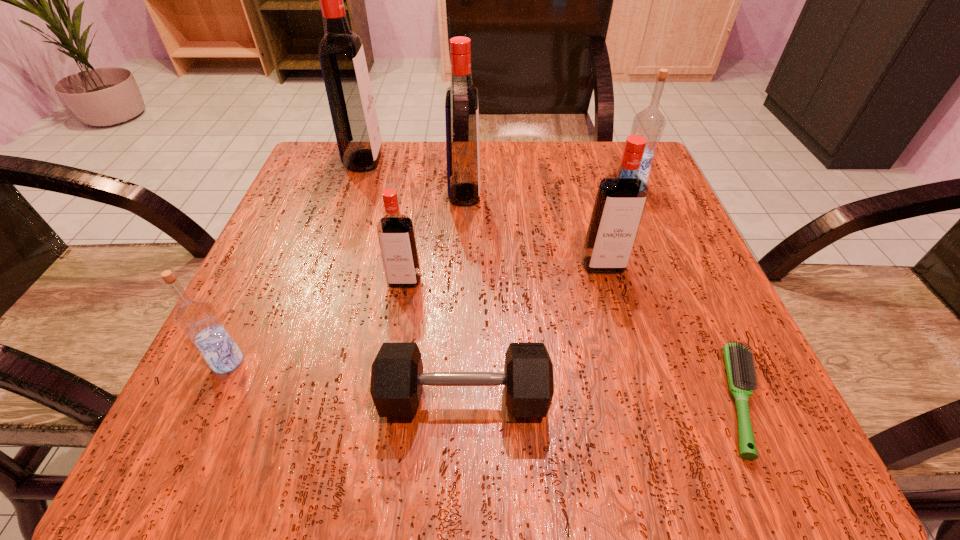
At what (x,y) coordinates should I click in order to perform the action: click on the nearer blue vodka. Please return your answer as a coordinate pair (x, y). This screenshot has width=960, height=540. Looking at the image, I should click on (197, 318).

I want to click on the smaller blue vodka, so (x=197, y=318).

Locate an element on the screen. The height and width of the screenshot is (540, 960). dumbbell is located at coordinates (397, 378).

Where is `the shortest object`? the shortest object is located at coordinates (739, 361).

Find the location of `light hairbrush`. light hairbrush is located at coordinates (739, 361).

You are a GUI agent. You are given a task and a screenshot of the screen. Output one action in this format:
    pyautogui.click(x=<x>, y=<y>)
    Task: Click on the free space located on the front and back of the fifth vodka from right to left
    This screenshot has width=960, height=540.
    Given the screenshot: What is the action you would take?
    pyautogui.click(x=482, y=160)

Identify the location of vacant area located on the front and back of the second biggest red vodka. (543, 194).

This screenshot has height=540, width=960. In order to click on vacant point located on the front of the farther blue vodka in this screenshot , I will do `click(681, 303)`.

Identify the location of free space located on the front and back of the sixth object from left to right. This screenshot has height=540, width=960. (612, 298).

This screenshot has width=960, height=540. I want to click on vacant space located on the front and back of the third red vodka from right to left, so click(x=398, y=318).